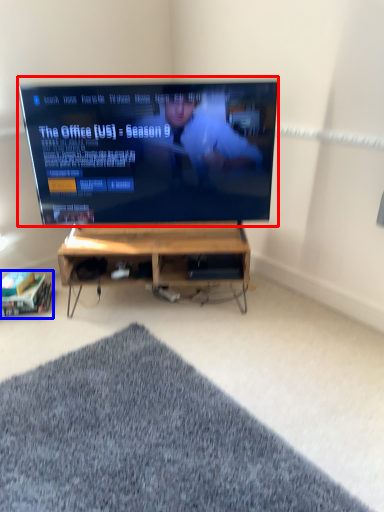
Question: Which point is further to the camera, television (highlighted by a red box) or shelf (highlighted by a blue box)?

Choices:
 (A) television
 (B) shelf

Answer: (B)